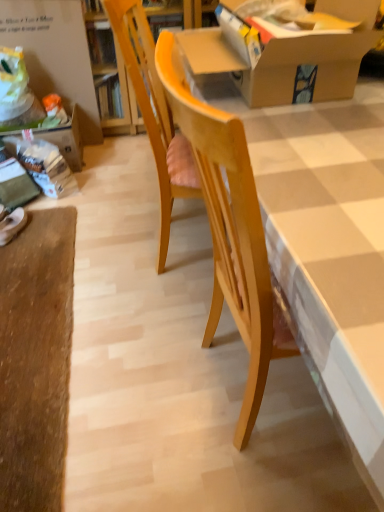
Question: Considering the relative sizes of white matte shoe at lower left and wooden table at center in the image provided, is white matte shoe at lower left bigger than wooden table at center?

Choices:
 (A) no
 (B) yes

Answer: (A)

Question: Does white matte shoe at lower left have a smaller size compared to wooden table at center?

Choices:
 (A) yes
 (B) no

Answer: (A)

Question: Is white matte shoe at lower left positioned before wooden table at center?

Choices:
 (A) no
 (B) yes

Answer: (A)

Question: From the image's perspective, does white matte shoe at lower left appear lower than wooden table at center?

Choices:
 (A) yes
 (B) no

Answer: (A)

Question: Is white matte shoe at lower left wider than wooden table at center?

Choices:
 (A) yes
 (B) no

Answer: (B)

Question: Considering the positions of point (274, 57) and point (130, 45), is point (274, 57) closer or farther from the camera than point (130, 45)?

Choices:
 (A) farther
 (B) closer

Answer: (B)

Question: Is cardboard box at upper center taller or shorter than light wood chair at center?

Choices:
 (A) tall
 (B) short

Answer: (B)

Question: Considering the positions of cardboard box at upper center and light wood chair at center in the image, is cardboard box at upper center wider or thinner than light wood chair at center?

Choices:
 (A) thin
 (B) wide

Answer: (B)

Question: Would you say cardboard box at upper center is inside or outside light wood chair at center?

Choices:
 (A) inside
 (B) outside

Answer: (A)

Question: From a real-world perspective, is white matte shoe at lower left physically located above or below cardboard box at upper center?

Choices:
 (A) above
 (B) below

Answer: (B)

Question: Is white matte shoe at lower left inside or outside of cardboard box at upper center?

Choices:
 (A) inside
 (B) outside

Answer: (B)

Question: In terms of width, does white matte shoe at lower left look wider or thinner when compared to cardboard box at upper center?

Choices:
 (A) wide
 (B) thin

Answer: (B)

Question: In the image, is white matte shoe at lower left on the left side or the right side of cardboard box at upper center?

Choices:
 (A) right
 (B) left

Answer: (B)

Question: Considering the positions of white matte shoe at lower left and light wood chair at center in the image, is white matte shoe at lower left taller or shorter than light wood chair at center?

Choices:
 (A) short
 (B) tall

Answer: (A)

Question: Based on their positions, is white matte shoe at lower left located to the left or right of light wood chair at center?

Choices:
 (A) left
 (B) right

Answer: (A)